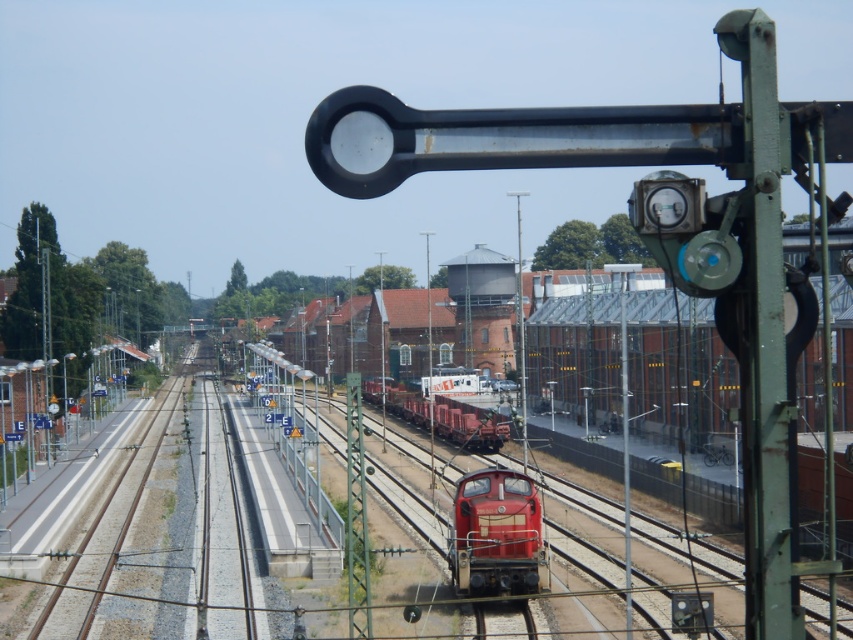
You are a railway engineer inspecting the tracks. You notice the shiny red locomotive at center and the matte red train at center. Which one has a narrower width?

The shiny red locomotive at center is thinner than the matte red train at center, so it has a narrower width.

You are standing at the point marked by coordinates point [497,536] in the railway station. What object is directly in front of you?

The point [497,536] marks the shiny red locomotive at center, so the object directly in front of you is the shiny red locomotive at center.

You are a railway engineer who needs to determine which of the two red vehicles, the shiny red locomotive at center or the matte red train at center, can fit through a tunnel with a height clearance of 4 meters. Which one is shorter in height?

The shiny red locomotive at center is smaller than the matte red train at center, so the shiny red locomotive at center is shorter and can fit through the tunnel with a 4 meter height clearance.